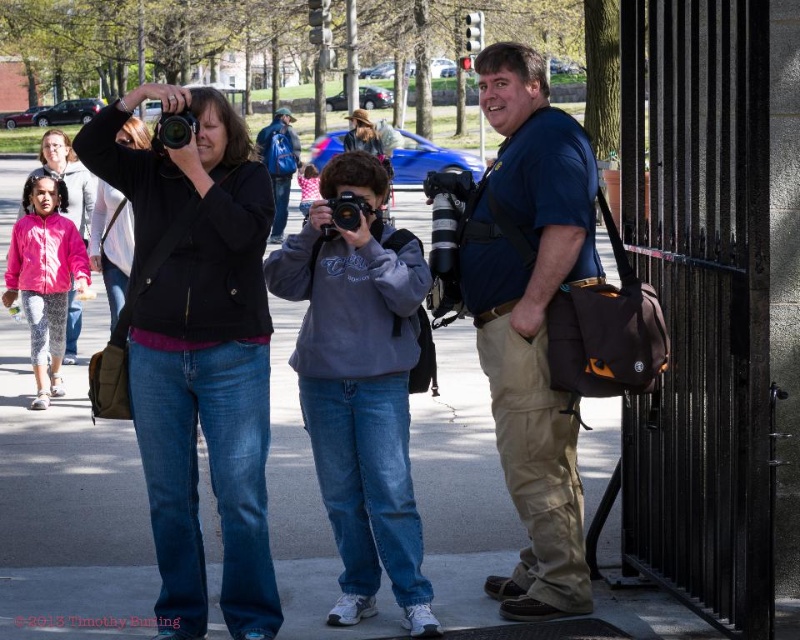
Which is above, blue shirt at right or blue backpack at center?

blue backpack at center

Is blue shirt at right taller than blue backpack at center?

No, blue shirt at right is not taller than blue backpack at center.

Measure the distance between point (518, 592) and camera.

The distance of point (518, 592) from camera is 21.12 feet.

Image resolution: width=800 pixels, height=640 pixels. I want to click on blue shirt at right, so click(530, 320).

Who is higher up, blue shirt at right or pink fleece jacket at left?

pink fleece jacket at left is above.

Does point (545, 556) lie behind point (84, 234)?

That is False.

At what (x,y) coordinates should I click in order to perform the action: click on blue shirt at right. Please return your answer as a coordinate pair (x, y). Looking at the image, I should click on coord(530,320).

Between matte black jacket at center and gray fleece sweatshirt at center, which one has more height?

matte black jacket at center

Does matte black jacket at center have a lesser width compared to gray fleece sweatshirt at center?

In fact, matte black jacket at center might be wider than gray fleece sweatshirt at center.

Which is behind, point (144, 212) or point (368, 280)?

The point (368, 280) is more distant.

You are a GUI agent. You are given a task and a screenshot of the screen. Output one action in this format:
    pyautogui.click(x=<x>, y=<y>)
    Task: Click on the matte black jacket at center
    Image resolution: width=800 pixels, height=640 pixels.
    Given the screenshot: What is the action you would take?
    pyautogui.click(x=200, y=352)